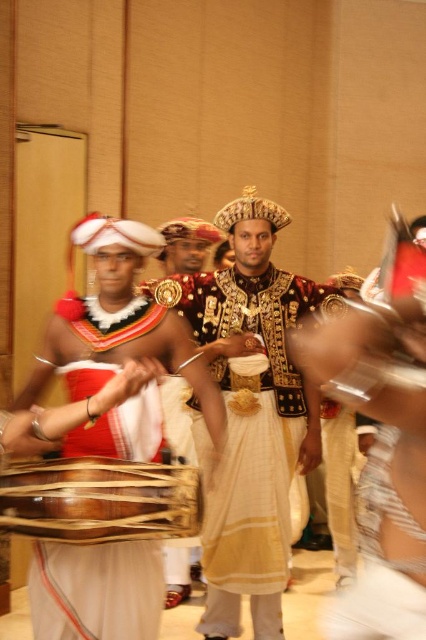
Question: Can you confirm if gold textured fabric at center is positioned to the left of wooden drum at center?

Choices:
 (A) no
 (B) yes

Answer: (A)

Question: Is gold textured fabric at center positioned at the back of wooden drum at center?

Choices:
 (A) no
 (B) yes

Answer: (B)

Question: Which point is closer to the camera?

Choices:
 (A) gold textured fabric at center
 (B) wooden drum at center

Answer: (B)

Question: Which of the following is the closest to the observer?

Choices:
 (A) (195, 433)
 (B) (28, 512)

Answer: (B)

Question: Is gold textured fabric at center closer to the viewer compared to wooden drum at center?

Choices:
 (A) yes
 (B) no

Answer: (B)